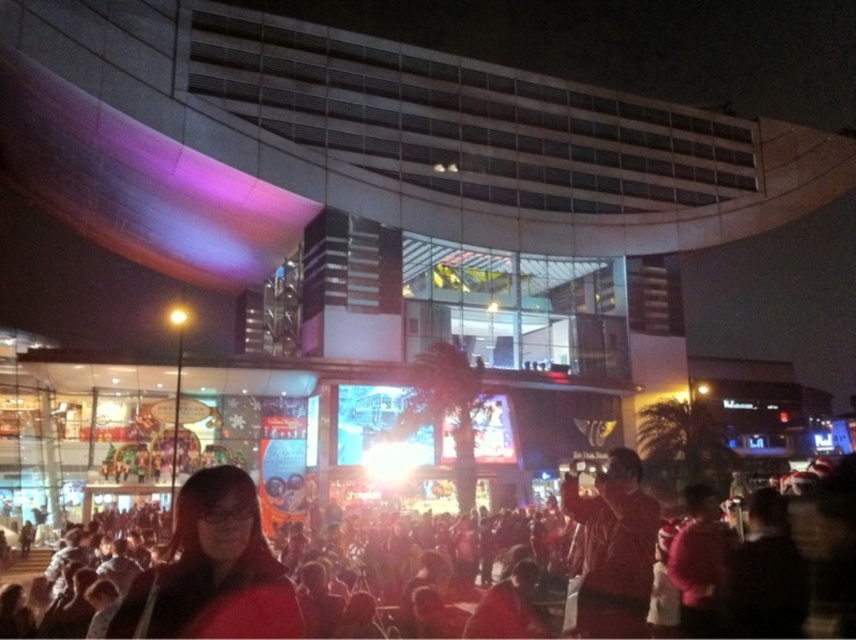
In the scene shown: Is matte black crowd at center to the left of matte black hair at lower center from the viewer's perspective?

No, matte black crowd at center is not to the left of matte black hair at lower center.

Between point (724, 600) and point (247, 528), which one is positioned in front?

Positioned in front is point (247, 528).

Locate an element on the screen. This screenshot has width=856, height=640. matte black crowd at center is located at coordinates (272, 582).

At what (x,y) coordinates should I click in order to perform the action: click on matte black crowd at center. Please return your answer as a coordinate pair (x, y). This screenshot has height=640, width=856. Looking at the image, I should click on (272, 582).

Is point (215, 616) closer to viewer compared to point (639, 612)?

Yes, it is in front of point (639, 612).

Is matte black hair at lower center to the left of red leather jacket at lower right from the viewer's perspective?

Yes, matte black hair at lower center is to the left of red leather jacket at lower right.

Who is more forward, (x=217, y=502) or (x=608, y=579)?

Point (x=217, y=502) is more forward.

At what (x,y) coordinates should I click in order to perform the action: click on matte black hair at lower center. Please return your answer as a coordinate pair (x, y). The width and height of the screenshot is (856, 640). Looking at the image, I should click on (212, 570).

Which is in front, point (319, 630) or point (634, 573)?

Positioned in front is point (634, 573).

Between matte black crowd at center and red leather jacket at lower right, which one has less height?

Standing shorter between the two is red leather jacket at lower right.

Does point (467, 563) come farther from viewer compared to point (657, 504)?

Yes, point (467, 563) is behind point (657, 504).

Where is `matte black crowd at center`? This screenshot has height=640, width=856. matte black crowd at center is located at coordinates (272, 582).